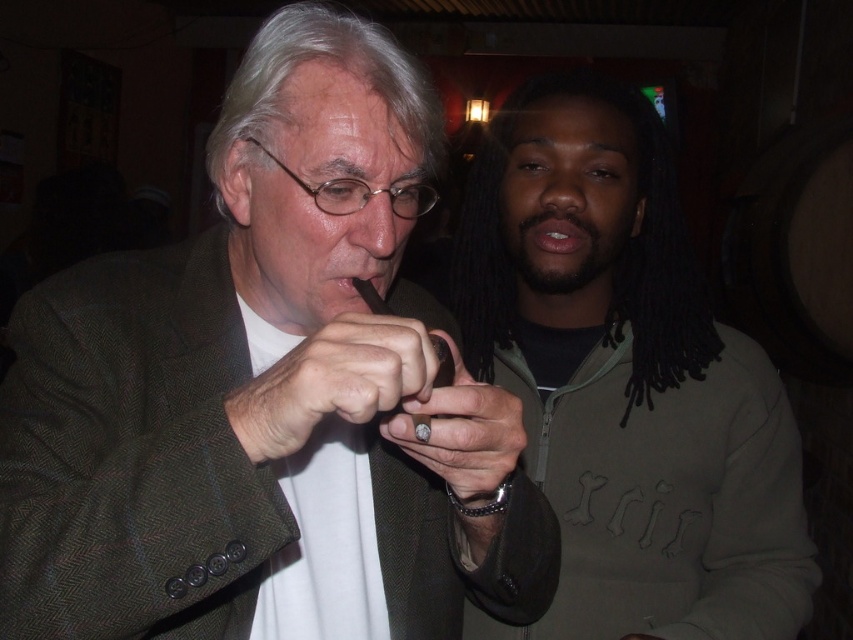
Is point (479, 428) closer to viewer compared to point (573, 221)?

Yes, point (479, 428) is in front of point (573, 221).

Who is shorter, silver metallic ring at center or pink glossy lips at center?

With less height is pink glossy lips at center.

Which is in front, point (418, 417) or point (579, 220)?

Positioned in front is point (418, 417).

Locate an element on the screen. The height and width of the screenshot is (640, 853). silver metallic ring at center is located at coordinates (461, 432).

What do you see at coordinates (267, 392) in the screenshot? This screenshot has height=640, width=853. I see `green textured blazer at center` at bounding box center [267, 392].

Who is more forward, (x=189, y=525) or (x=577, y=506)?

Point (x=189, y=525) is in front.

This screenshot has height=640, width=853. What do you see at coordinates (267, 392) in the screenshot? I see `green textured blazer at center` at bounding box center [267, 392].

The image size is (853, 640). Identify the location of green textured blazer at center. (267, 392).

Which is more to the left, green textured blazer at center or black matte mouth at center?

green textured blazer at center is more to the left.

Is point (102, 368) in front of point (355, 275)?

Yes.

What do you see at coordinates (267, 392) in the screenshot? The image size is (853, 640). I see `green textured blazer at center` at bounding box center [267, 392].

Where is `green textured blazer at center`? green textured blazer at center is located at coordinates (267, 392).